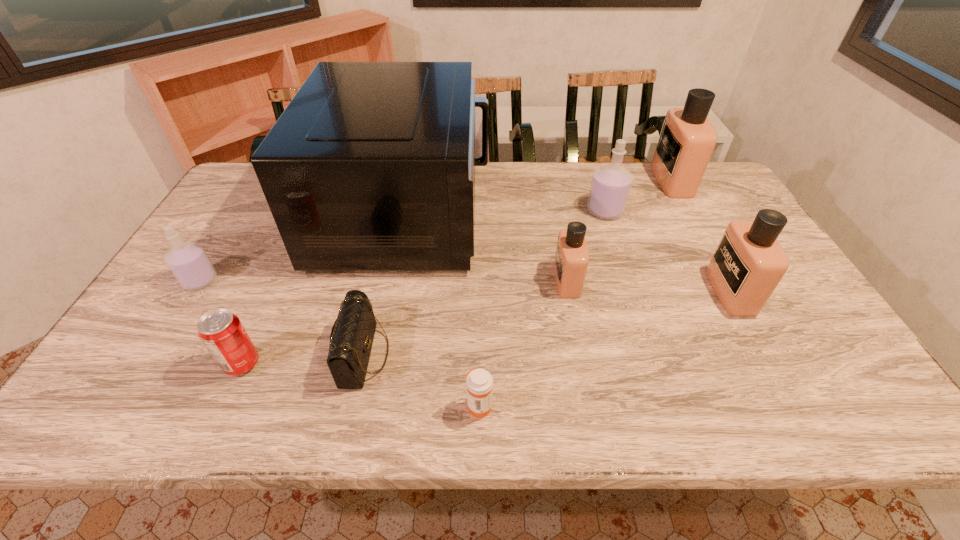
Locate an element on the screen. The height and width of the screenshot is (540, 960). the tallest object is located at coordinates (371, 167).

Find the location of a particular element. The height and width of the screenshot is (540, 960). the eighth shortest object is located at coordinates (687, 139).

Where is `the biggest beige perfume`? The height and width of the screenshot is (540, 960). the biggest beige perfume is located at coordinates (687, 139).

Locate an element on the screen. This screenshot has height=540, width=960. the third perfume from left to right is located at coordinates (611, 184).

At what (x,y) coordinates should I click in order to perform the action: click on the bigger purple perfume. Please return your answer as a coordinate pair (x, y). The width and height of the screenshot is (960, 540). Looking at the image, I should click on (611, 184).

The width and height of the screenshot is (960, 540). Identify the location of the second biggest beige perfume. (749, 262).

Locate an element on the screen. Image resolution: width=960 pixels, height=540 pixels. the fourth object from right to left is located at coordinates (571, 261).

Locate an element on the screen. The height and width of the screenshot is (540, 960). the fourth perfume from right to left is located at coordinates (571, 261).

Where is `the nearer purple perfume`? The height and width of the screenshot is (540, 960). the nearer purple perfume is located at coordinates (189, 263).

This screenshot has height=540, width=960. In order to click on the smaller purple perfume in this screenshot , I will do `click(189, 263)`.